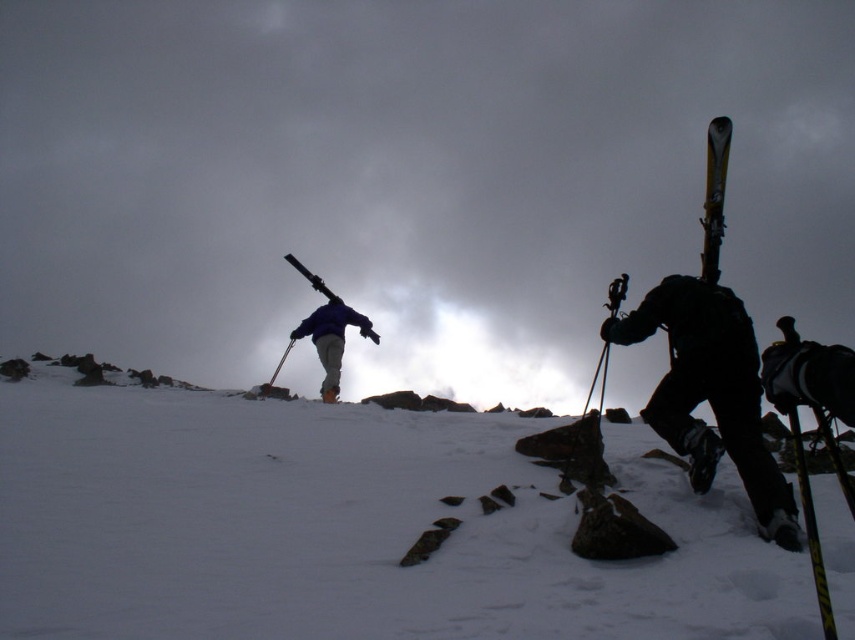
You are a photographer trying to capture both the black matte ski at right and the glossy metallic ski at upper right in a single frame. Which ski should you adjust your camera to focus on first if you want to include both in your shot?

The black matte ski at right is positioned on the left side of the glossy metallic ski at upper right, so you should focus on the glossy metallic ski at upper right first to ensure both are in frame.

You are standing at point point (161,474) and want to take a photo of the snowy mountain landscape. The camera you have can capture objects within a 10 meter range. Will the camera be able to capture the entire scene from your current position?

The camera is 7.45 meters away from point (161,474), which is within the 10 meter range. Therefore, the camera can capture the entire scene from your current position.

You are a photographer trying to capture a photo of the blue fabric jacket at center and the black matte ski at right. Based on their positions, which object should you focus on first to ensure both are in sharp focus?

The black matte ski at right is below blue fabric jacket at center, so you should focus on the blue fabric jacket at center first since it is closer to the camera.